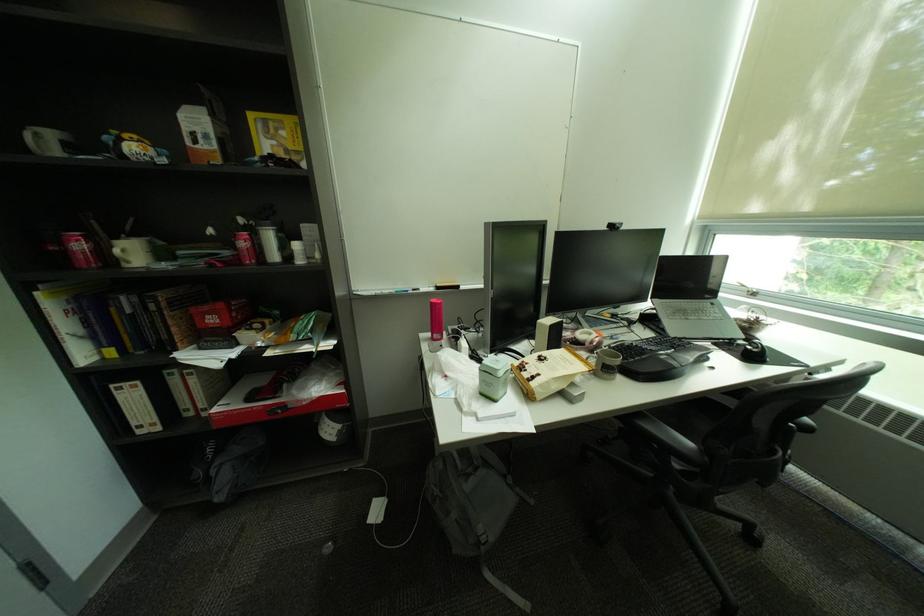
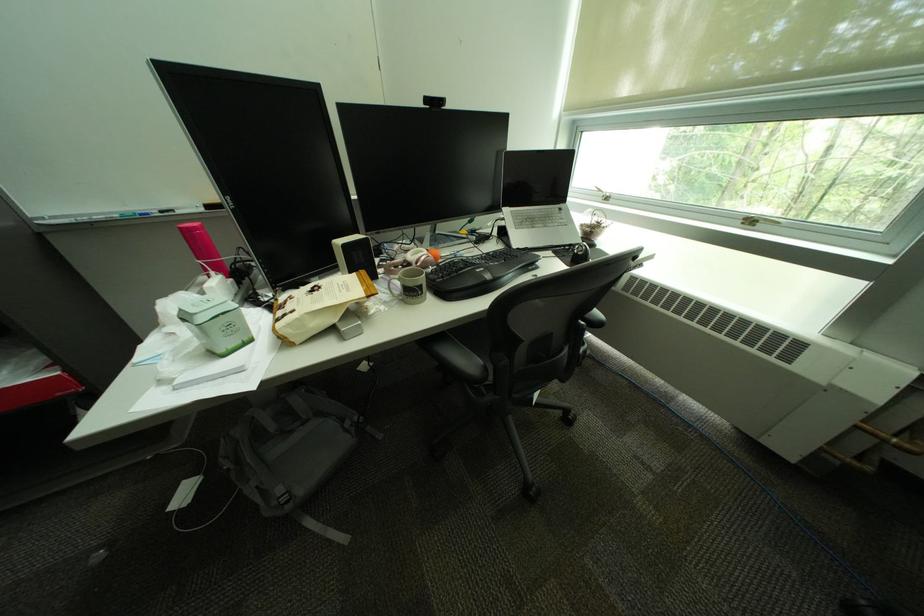
Where in the second image is the point corresponding to (803,426) from the first image?

(593, 323)